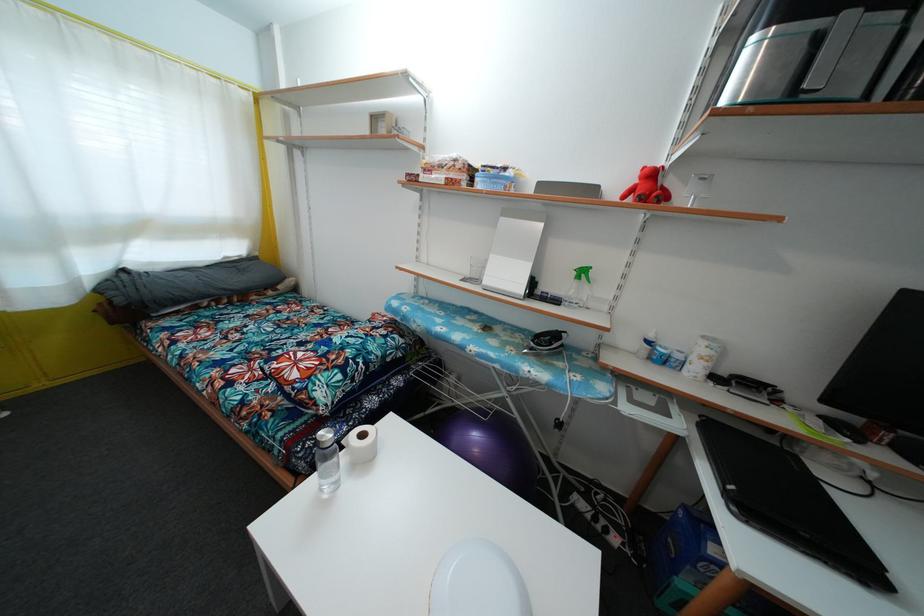
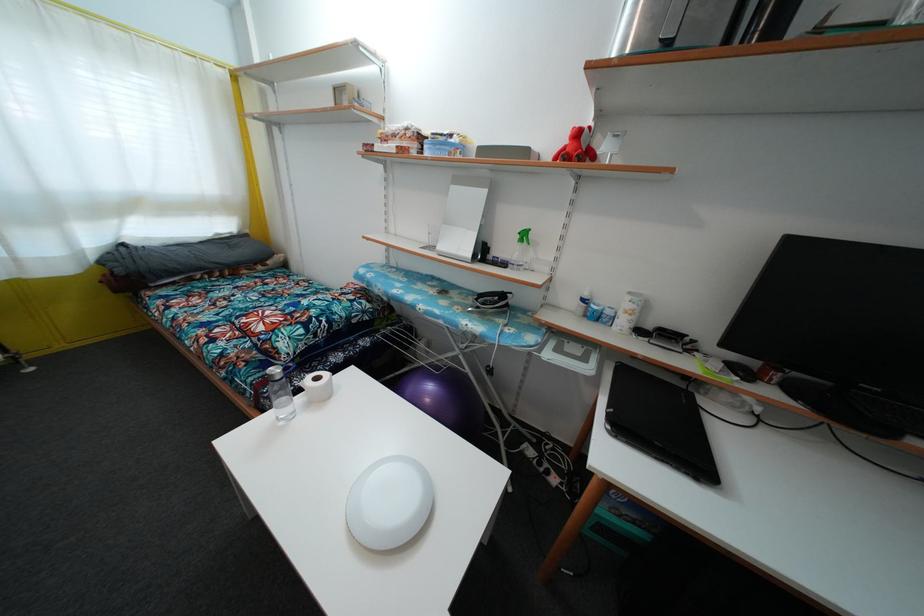
Locate, in the second image, the point that corresponds to the point at 640,188 in the first image.

(570, 148)